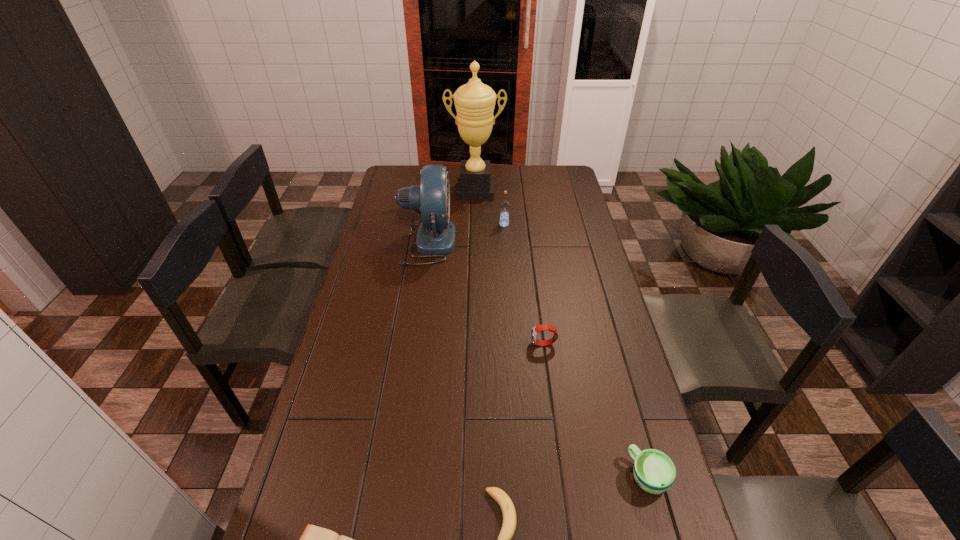
The width and height of the screenshot is (960, 540). I want to click on the tallest object, so click(474, 102).

Identify the location of trophy cup. The height and width of the screenshot is (540, 960). (474, 102).

Identify the location of the sixth shortest object. (436, 235).

Where is `the third tallest object`? Image resolution: width=960 pixels, height=540 pixels. the third tallest object is located at coordinates (504, 206).

Where is `watch`? Image resolution: width=960 pixels, height=540 pixels. watch is located at coordinates (542, 327).

You are a GUI agent. You are given a task and a screenshot of the screen. Output one action in this format:
    pyautogui.click(x=<x>, y=<y>)
    Task: Click on the fourth farthest object
    
    Given the screenshot: What is the action you would take?
    pyautogui.click(x=542, y=327)

Identify the location of the rightmost object. (654, 471).

At what (x,y) coordinates should I click in order to perform the action: click on blank space located at the front of the tallest object with handles. Please return your answer as a coordinate pair (x, y). The height and width of the screenshot is (540, 960). Looking at the image, I should click on (475, 243).

This screenshot has width=960, height=540. Find the location of `vacant region located 0.260m in front of the fan to blow air`. vacant region located 0.260m in front of the fan to blow air is located at coordinates (518, 242).

Identify the location of free space located on the left of the third tallest object. (433, 225).